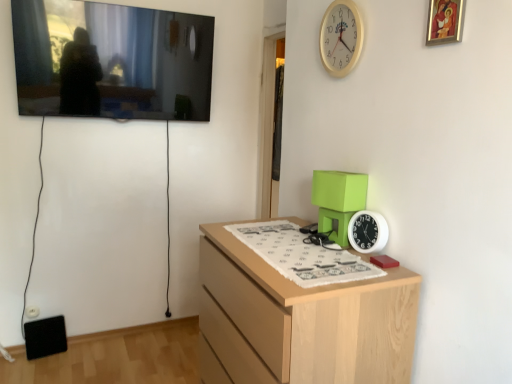
Question: Does light wood chest of drawers at center come in front of flat screen tv at upper left, which appears as the 2th picture frame when viewed from the right?

Choices:
 (A) no
 (B) yes

Answer: (B)

Question: From a real-world perspective, is light wood chest of drawers at center positioned under flat screen tv at upper left, the first picture frame from the back, based on gravity?

Choices:
 (A) no
 (B) yes

Answer: (B)

Question: Can you confirm if light wood chest of drawers at center is taller than flat screen tv at upper left, placed as the first picture frame when sorted from left to right?

Choices:
 (A) no
 (B) yes

Answer: (B)

Question: From the image's perspective, would you say light wood chest of drawers at center is shown under flat screen tv at upper left, placed as the second picture frame when sorted from front to back?

Choices:
 (A) no
 (B) yes

Answer: (B)

Question: From a real-world perspective, is light wood chest of drawers at center physically above flat screen tv at upper left, placed as the first picture frame when sorted from left to right?

Choices:
 (A) no
 (B) yes

Answer: (A)

Question: Could flat screen tv at upper left, placed as the second picture frame when sorted from front to back, be considered to be inside light wood chest of drawers at center?

Choices:
 (A) no
 (B) yes

Answer: (A)

Question: Are white plastic clock at upper right, the 1th clock viewed from the top, and gold-framed painting at upper right, which is counted as the 1th picture frame, starting from the front, making contact?

Choices:
 (A) no
 (B) yes

Answer: (A)

Question: Is white plastic clock at upper right, placed as the second clock when sorted from bottom to top, looking in the opposite direction of gold-framed painting at upper right, which is counted as the 1th picture frame, starting from the front?

Choices:
 (A) no
 (B) yes

Answer: (A)

Question: From the image's perspective, does white plastic clock at upper right, the 1th clock viewed from the top, appear higher than gold-framed painting at upper right, positioned as the 2th picture frame in left-to-right order?

Choices:
 (A) no
 (B) yes

Answer: (B)

Question: From a real-world perspective, is white plastic clock at upper right, placed as the second clock when sorted from bottom to top, physically above gold-framed painting at upper right, positioned as the 2th picture frame in left-to-right order?

Choices:
 (A) no
 (B) yes

Answer: (A)

Question: Is white plastic clock at upper right, the 1th clock viewed from the top, aimed at gold-framed painting at upper right, arranged as the first picture frame when viewed from the right?

Choices:
 (A) no
 (B) yes

Answer: (A)

Question: Is gold-framed painting at upper right, which is counted as the 1th picture frame, starting from the front, surrounded by white plastic clock at upper right, the 1th clock viewed from the top?

Choices:
 (A) no
 (B) yes

Answer: (A)

Question: From the image's perspective, is light wood chest of drawers at center on top of white plastic clock at right, which is counted as the 1th clock, starting from the bottom?

Choices:
 (A) yes
 (B) no

Answer: (B)